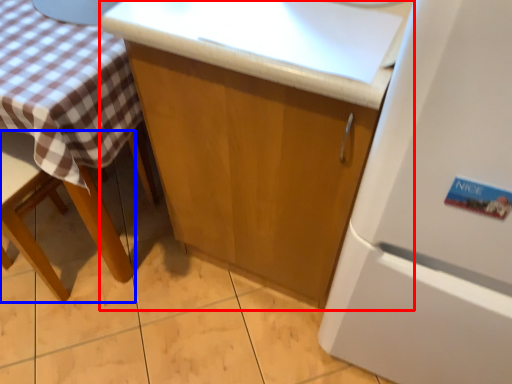
Question: Which object appears farthest to the camera in this image, cabinetry (highlighted by a red box) or chair (highlighted by a blue box)?

Choices:
 (A) cabinetry
 (B) chair

Answer: (B)